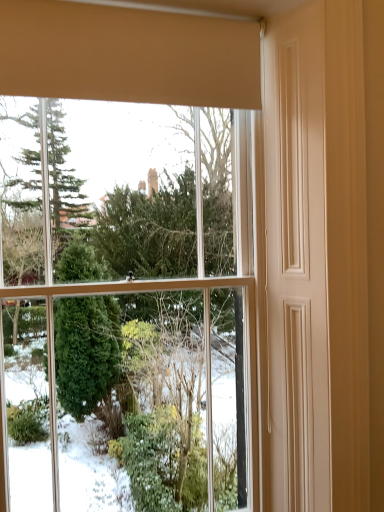
Question: Should I look upward or downward to see beige matte curtain at upper center?

Choices:
 (A) up
 (B) down

Answer: (A)

Question: Could clear glass window at upper center be considered to be inside beige matte curtain at upper center?

Choices:
 (A) no
 (B) yes

Answer: (A)

Question: Considering the relative positions of beige matte curtain at upper center and clear glass window at upper center in the image provided, is beige matte curtain at upper center to the right of clear glass window at upper center from the viewer's perspective?

Choices:
 (A) yes
 (B) no

Answer: (A)

Question: Is beige matte curtain at upper center facing away from clear glass window at upper center?

Choices:
 (A) yes
 (B) no

Answer: (B)

Question: From a real-world perspective, is beige matte curtain at upper center under clear glass window at upper center?

Choices:
 (A) yes
 (B) no

Answer: (B)

Question: Is the depth of beige matte curtain at upper center greater than that of clear glass window at upper center?

Choices:
 (A) yes
 (B) no

Answer: (B)

Question: Considering the relative sizes of beige matte curtain at upper center and clear glass window at upper center in the image provided, is beige matte curtain at upper center smaller than clear glass window at upper center?

Choices:
 (A) yes
 (B) no

Answer: (A)

Question: Considering the relative sizes of clear glass window at upper center and beige matte curtain at upper center in the image provided, is clear glass window at upper center shorter than beige matte curtain at upper center?

Choices:
 (A) yes
 (B) no

Answer: (B)

Question: Is clear glass window at upper center not close to beige matte curtain at upper center?

Choices:
 (A) yes
 (B) no

Answer: (B)

Question: Is clear glass window at upper center smaller than beige matte curtain at upper center?

Choices:
 (A) yes
 (B) no

Answer: (B)

Question: Considering the relative positions of clear glass window at upper center and beige matte curtain at upper center in the image provided, is clear glass window at upper center to the right of beige matte curtain at upper center from the viewer's perspective?

Choices:
 (A) yes
 (B) no

Answer: (B)

Question: Could you tell me if clear glass window at upper center is turned towards beige matte curtain at upper center?

Choices:
 (A) yes
 (B) no

Answer: (B)

Question: Is clear glass window at upper center to the left of beige matte curtain at upper center from the viewer's perspective?

Choices:
 (A) yes
 (B) no

Answer: (A)

Question: From their relative heights in the image, would you say clear glass window at upper center is taller or shorter than beige matte curtain at upper center?

Choices:
 (A) tall
 (B) short

Answer: (A)